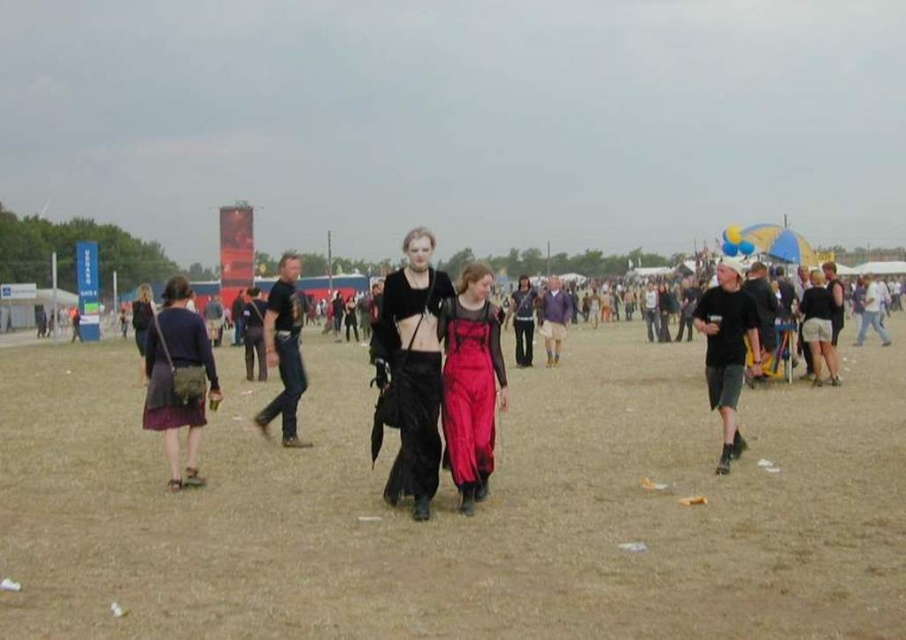
In the scene shown: Is matte purple skirt at lower left wider than satin dress at center?

Correct, the width of matte purple skirt at lower left exceeds that of satin dress at center.

How distant is matte purple skirt at lower left from satin dress at center?

2.51 meters

Which is in front, point (176, 445) or point (492, 397)?

Positioned in front is point (492, 397).

Locate an element on the screen. matte purple skirt at lower left is located at coordinates (178, 380).

In the scene shown: Between matte purple skirt at lower left and black leather pants at center, which one is positioned lower?

Positioned lower is matte purple skirt at lower left.

In the scene shown: Is matte purple skirt at lower left smaller than black leather pants at center?

Yes, matte purple skirt at lower left is smaller than black leather pants at center.

Which is in front, point (213, 378) or point (288, 278)?

Point (213, 378) is in front.

The height and width of the screenshot is (640, 906). What are the coordinates of `matte purple skirt at lower left` in the screenshot? It's located at (178, 380).

Is point (895, 580) farther from viewer compared to point (294, 307)?

No.

Does brown sandy ground at center come behind black leather pants at center?

No, brown sandy ground at center is in front of black leather pants at center.

What do you see at coordinates (455, 512) in the screenshot? This screenshot has height=640, width=906. I see `brown sandy ground at center` at bounding box center [455, 512].

Find the location of a particular element. brown sandy ground at center is located at coordinates (455, 512).